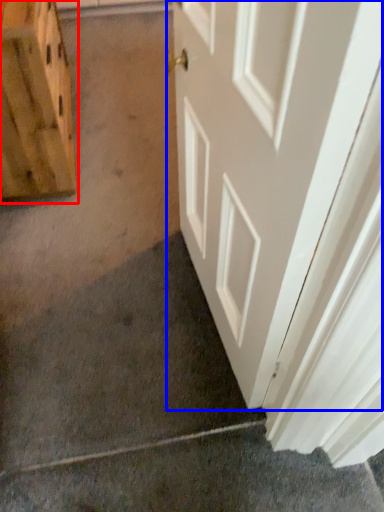
Question: Which of the following is the closest to the observer, cabinetry (highlighted by a red box) or door (highlighted by a blue box)?

Choices:
 (A) cabinetry
 (B) door

Answer: (B)